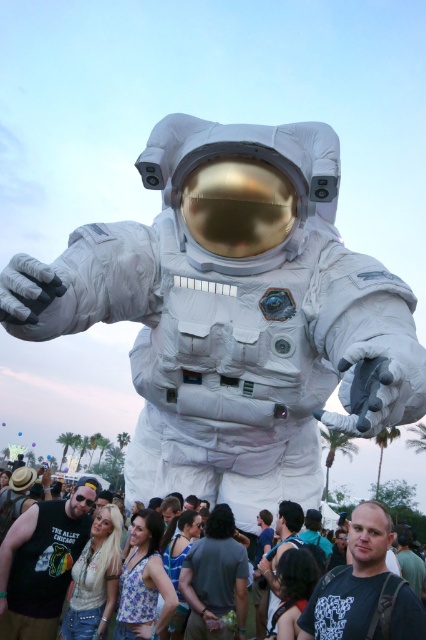
You are taking a photo of the inflatable astronaut and need to focus on both the chest emblem and the palm trees in the background. Which of the two points, point (22, 593) or point (307, 636), is closer to the camera?

Point (22, 593) is further to the camera than point (307, 636), so the point closer to the camera is point (307, 636).